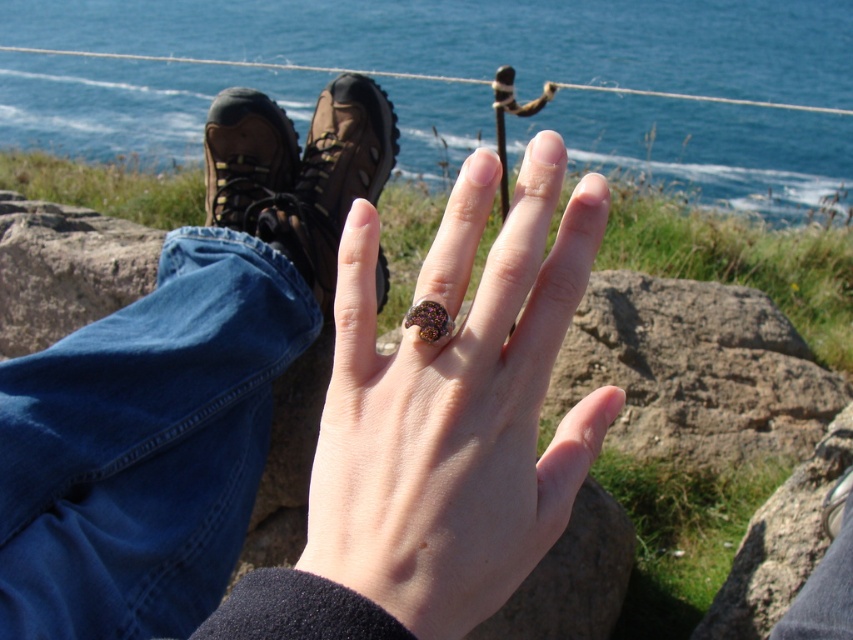
Is point (57, 337) less distant than point (238, 193)?

No, it is behind (238, 193).

Is point (84, 248) farther from viewer compared to point (250, 200)?

Yes, it is.

Does point (38, 257) come in front of point (258, 160)?

No, (38, 257) is behind (258, 160).

Identify the location of smooth gray rock at lower left. (65, 269).

Is shiny gold ring at center shorter than blue water at upper center?

No.

Describe the element at coordinates (322, 412) in the screenshot. I see `shiny gold ring at center` at that location.

Locate an element on the screen. shiny gold ring at center is located at coordinates [x=322, y=412].

Can you confirm if rough textured rock at lower right is bigger than shiny purple gemstone ring at center?

Indeed, rough textured rock at lower right has a larger size compared to shiny purple gemstone ring at center.

Find the location of a particular element. This screenshot has width=853, height=640. rough textured rock at lower right is located at coordinates (779, 544).